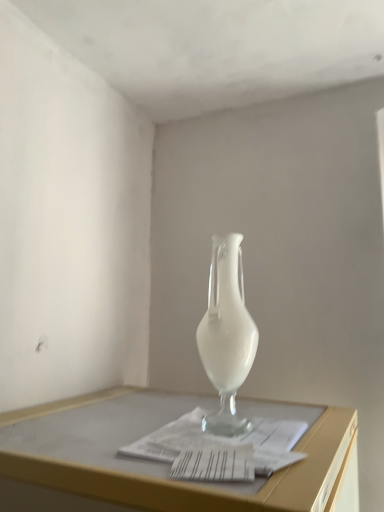
Question: Relative to white glass vase at center, is white paper at center in front or behind?

Choices:
 (A) behind
 (B) front

Answer: (B)

Question: Is white paper at center to the left or to the right of white glass vase at center in the image?

Choices:
 (A) right
 (B) left

Answer: (B)

Question: From the image's perspective, is white paper at center positioned above or below white glass vase at center?

Choices:
 (A) below
 (B) above

Answer: (A)

Question: From their relative heights in the image, would you say white glass vase at center is taller or shorter than white paper at center?

Choices:
 (A) short
 (B) tall

Answer: (B)

Question: From the image's perspective, is white glass vase at center above or below white paper at center?

Choices:
 (A) below
 (B) above

Answer: (B)

Question: Considering the positions of white glass vase at center and white paper at center in the image, is white glass vase at center wider or thinner than white paper at center?

Choices:
 (A) thin
 (B) wide

Answer: (A)

Question: From a real-world perspective, is white glass vase at center above or below white paper at center?

Choices:
 (A) below
 (B) above

Answer: (B)